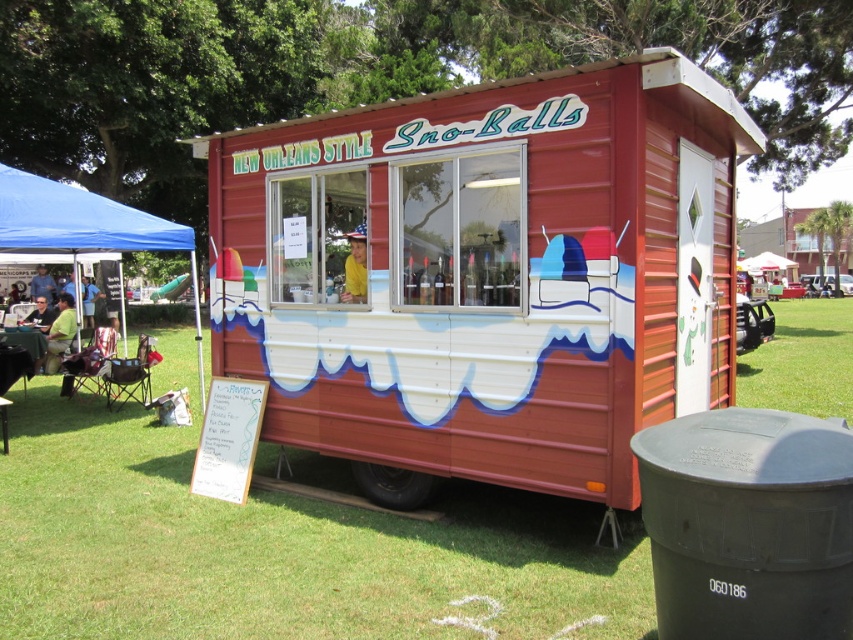
Question: Which point appears farthest from the camera in this image?

Choices:
 (A) (676, 340)
 (B) (39, 305)

Answer: (B)

Question: Is metallic red food truck at center bigger than brushed metal water at bottle left?

Choices:
 (A) no
 (B) yes

Answer: (B)

Question: Is metallic red food truck at center to the left of blue fabric canopy at left from the viewer's perspective?

Choices:
 (A) yes
 (B) no

Answer: (B)

Question: In this image, where is green grass at lower center located relative to green fabric shirt at lower left?

Choices:
 (A) left
 (B) right

Answer: (B)

Question: Which point is farther to the camera?

Choices:
 (A) metallic red food truck at center
 (B) brushed metal water at bottle left
 (C) blue fabric tent at left

Answer: (B)

Question: Which point is closer to the camera?

Choices:
 (A) (817, 316)
 (B) (473, 445)

Answer: (B)